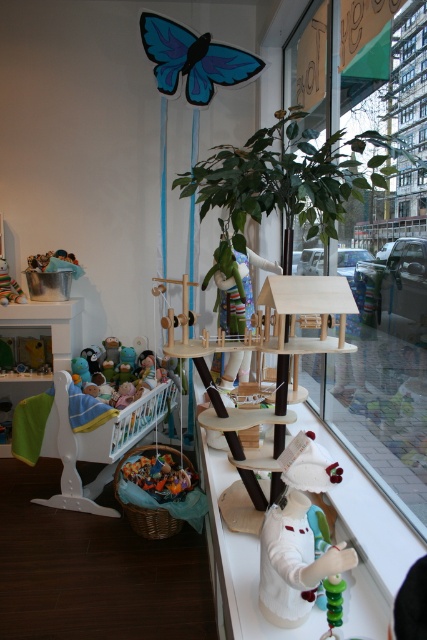
From the picture: You are a parent looking to buy a toy for your child. You see the white matte rabbit at center and the velvet plush monkey at left. Which toy is closer to you in the store?

The white matte rabbit at center is closer to you because it is positioned in front of the velvet plush monkey at left.

You are a parent carrying a 100 cm long ladder. You need to place it between the white wooden crib with green blanket and the white matte rabbit at center. Is there enough space to fit the ladder horizontally between them?

The distance between the white wooden crib with green blanket and the white matte rabbit at center is 97.41 centimeters. Since the ladder is 100 cm long, it is slightly longer than the available space. Therefore, the ladder cannot fit horizontally between them.

You are a parent holding a 100 cm tall toddler who wants to reach the white matte rabbit at center in the children store. Can the toddler reach it?

The white matte rabbit at center is 97.41 centimeters from viewer. Since the toddler is 100 cm tall, they can reach it.